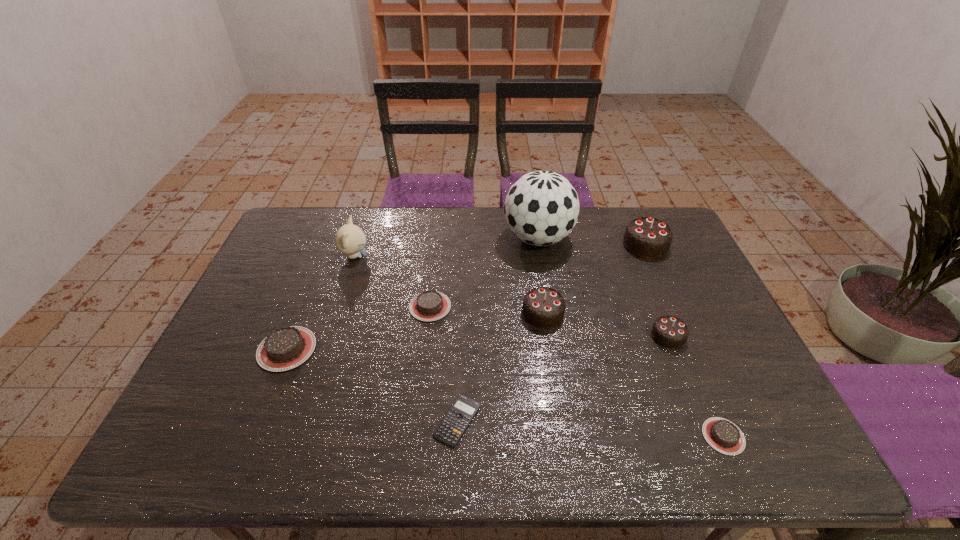
Identify which chocolate chocolate cake is the nearest to the farthest chocolate chocolate cake. Please provide its 2D coordinates. Your answer should be formatted as a tuple, i.e. [(x, y)], where the tuple contains the x and y coordinates of a point satisfying the conditions above.

[(670, 332)]

Where is `chocolate chocolate cake object that ranks as the closest to the smallest chocolate chocolate cake`? This screenshot has height=540, width=960. chocolate chocolate cake object that ranks as the closest to the smallest chocolate chocolate cake is located at coordinates (x=543, y=307).

Select which brown chocolate cake is the closest to the fourth tallest chocolate cake. Please provide its 2D coordinates. Your answer should be formatted as a tuple, i.e. [(x, y)], where the tuple contains the x and y coordinates of a point satisfying the conditions above.

[(430, 305)]

Locate which brown chocolate cake ranks in proximity to the second smallest brown chocolate cake. Please provide its 2D coordinates. Your answer should be formatted as a tuple, i.e. [(x, y)], where the tuple contains the x and y coordinates of a point satisfying the conditions above.

[(285, 348)]

Locate an element on the screen. free point that satisfies the following two spatial constraints: 1. on the back side of the farthest chocolate cake; 2. on the left side of the fifth shortest object is located at coordinates (632, 245).

Locate an element on the screen. This screenshot has height=540, width=960. vacant area that satisfies the following two spatial constraints: 1. on the face of the shortest chocolate cake; 2. on the left side of the kitten is located at coordinates tap(297, 436).